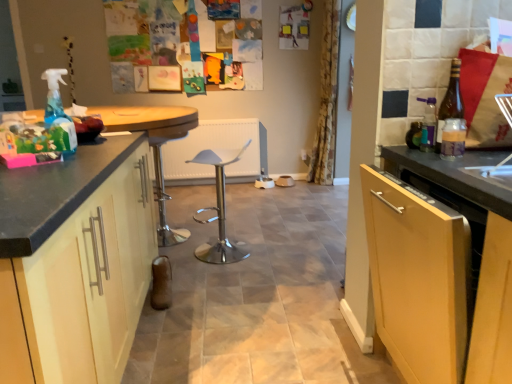
You are a GUI agent. You are given a task and a screenshot of the screen. Output one action in this format:
    pyautogui.click(x=<x>, y=<y>)
    Task: Click on the vacant space behind polished silver bar stool at center, positioned as the 1th bar stool in right-to-left order
    This screenshot has width=512, height=384.
    Given the screenshot: What is the action you would take?
    pyautogui.click(x=231, y=232)